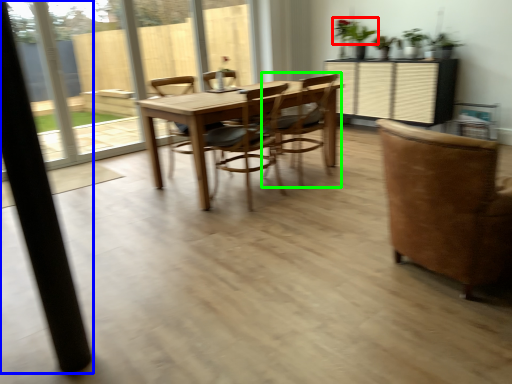
Question: Which object is positioned closest to plant (highlighted by a red box)? Select from pillar (highlighted by a blue box) and chair (highlighted by a green box).

Choices:
 (A) pillar
 (B) chair

Answer: (B)